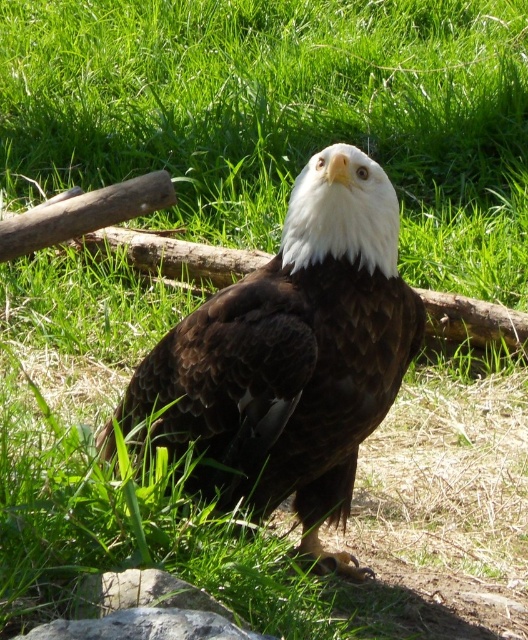
Question: Is gray rough stone at lower center wider than gray rough stone at lower left?

Choices:
 (A) yes
 (B) no

Answer: (A)

Question: Is brown feathered eagle at center below gray rough stone at lower center?

Choices:
 (A) yes
 (B) no

Answer: (B)

Question: Which object appears closest to the camera in this image?

Choices:
 (A) gray rough stone at lower left
 (B) gray rough stone at lower center
 (C) brown feathered eagle at center

Answer: (B)

Question: Considering the relative positions of gray rough stone at lower center and gray rough stone at lower left in the image provided, where is gray rough stone at lower center located with respect to gray rough stone at lower left?

Choices:
 (A) left
 (B) right

Answer: (B)

Question: Based on their relative distances, which object is farther from the gray rough stone at lower center?

Choices:
 (A) brown feathered eagle at center
 (B) gray rough stone at lower left

Answer: (A)

Question: Which of the following is the farthest from the observer?

Choices:
 (A) gray rough stone at lower left
 (B) brown feathered eagle at center
 (C) gray rough stone at lower center

Answer: (B)